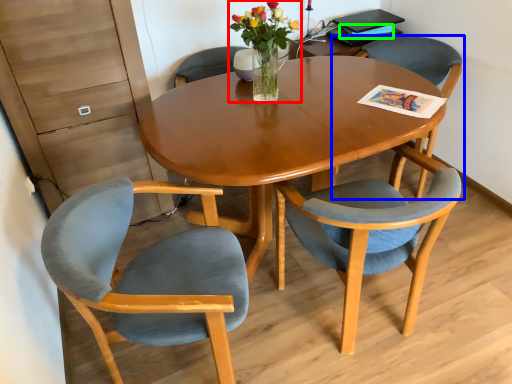
Question: Considering the real-world distances, which object is farthest from floral arrangement (highlighted by a red box)? chair (highlighted by a blue box) or magazine (highlighted by a green box)?

Choices:
 (A) chair
 (B) magazine

Answer: (B)